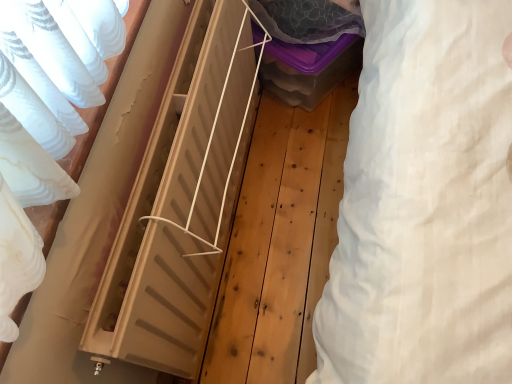
Question: Choose the correct answer: Is natural wood radiator at center inside translucent plastic storage box at center or outside it?

Choices:
 (A) inside
 (B) outside

Answer: (B)

Question: In terms of width, does natural wood radiator at center look wider or thinner when compared to translucent plastic storage box at center?

Choices:
 (A) thin
 (B) wide

Answer: (A)

Question: Which object is positioned closest to the white cotton sheet at right?

Choices:
 (A) translucent plastic storage box at center
 (B) natural wood radiator at center

Answer: (B)

Question: Estimate the real-world distances between objects in this image. Which object is closer to the translucent plastic storage box at center?

Choices:
 (A) natural wood radiator at center
 (B) white cotton sheet at right

Answer: (A)